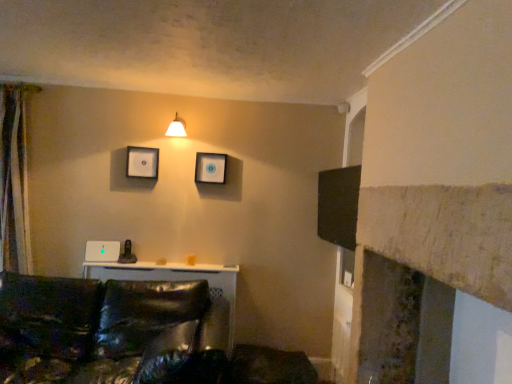
Question: Can you confirm if shiny black leather couch at lower left is bigger than matte plastic picture frame at upper center, which appears as the second picture frame when viewed from the left?

Choices:
 (A) no
 (B) yes

Answer: (B)

Question: Is shiny black leather couch at lower left far from matte plastic picture frame at upper center, which appears as the second picture frame when viewed from the left?

Choices:
 (A) no
 (B) yes

Answer: (B)

Question: Is shiny black leather couch at lower left shorter than matte plastic picture frame at upper center, placed as the 1th picture frame when sorted from right to left?

Choices:
 (A) no
 (B) yes

Answer: (A)

Question: Considering the relative sizes of shiny black leather couch at lower left and matte plastic picture frame at upper center, which appears as the second picture frame when viewed from the left, in the image provided, is shiny black leather couch at lower left taller than matte plastic picture frame at upper center, which appears as the second picture frame when viewed from the left,?

Choices:
 (A) no
 (B) yes

Answer: (B)

Question: Is shiny black leather couch at lower left facing away from matte plastic picture frame at upper center, placed as the 1th picture frame when sorted from right to left?

Choices:
 (A) no
 (B) yes

Answer: (A)

Question: From the image's perspective, is shiny black leather couch at lower left under matte plastic picture frame at upper center, which appears as the second picture frame when viewed from the left?

Choices:
 (A) yes
 (B) no

Answer: (A)

Question: From a real-world perspective, is shiny black leather couch at lower left on matte white picture frame at upper center, the 2th picture frame from the right?

Choices:
 (A) no
 (B) yes

Answer: (A)

Question: Does shiny black leather couch at lower left turn towards matte white picture frame at upper center, the 2th picture frame from the right?

Choices:
 (A) yes
 (B) no

Answer: (B)

Question: Is shiny black leather couch at lower left shorter than matte white picture frame at upper center, the 2th picture frame from the right?

Choices:
 (A) no
 (B) yes

Answer: (A)

Question: Considering the relative positions of shiny black leather couch at lower left and matte white picture frame at upper center, the 2th picture frame from the right, in the image provided, is shiny black leather couch at lower left in front of matte white picture frame at upper center, the 2th picture frame from the right,?

Choices:
 (A) yes
 (B) no

Answer: (A)

Question: Is shiny black leather couch at lower left positioned behind matte white picture frame at upper center, the first picture frame positioned from the left?

Choices:
 (A) yes
 (B) no

Answer: (B)

Question: Could matte white picture frame at upper center, the 2th picture frame from the right, be considered to be inside shiny black leather couch at lower left?

Choices:
 (A) yes
 (B) no

Answer: (B)

Question: Does matte white picture frame at upper center, the 2th picture frame from the right, have a greater width compared to silky beige curtain at left?

Choices:
 (A) no
 (B) yes

Answer: (A)